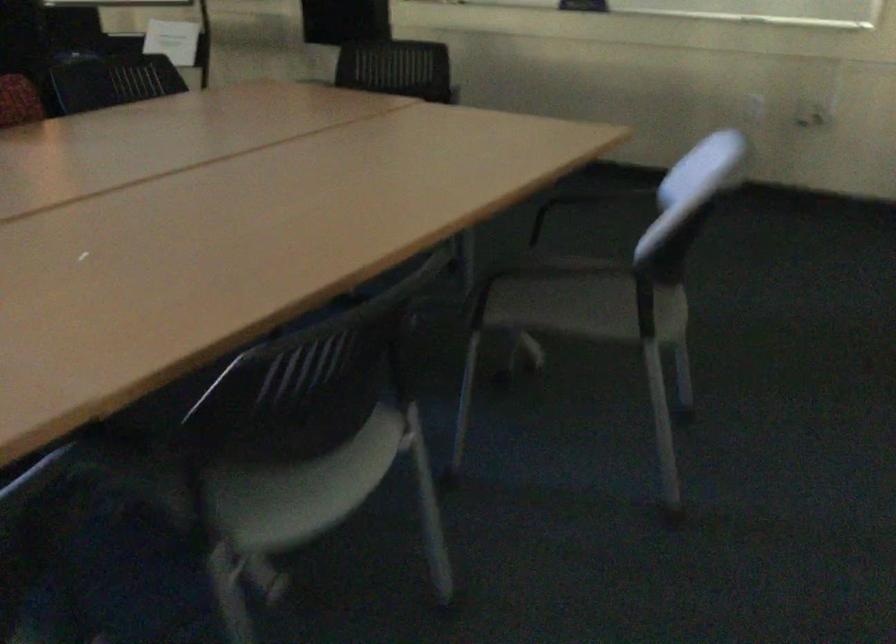
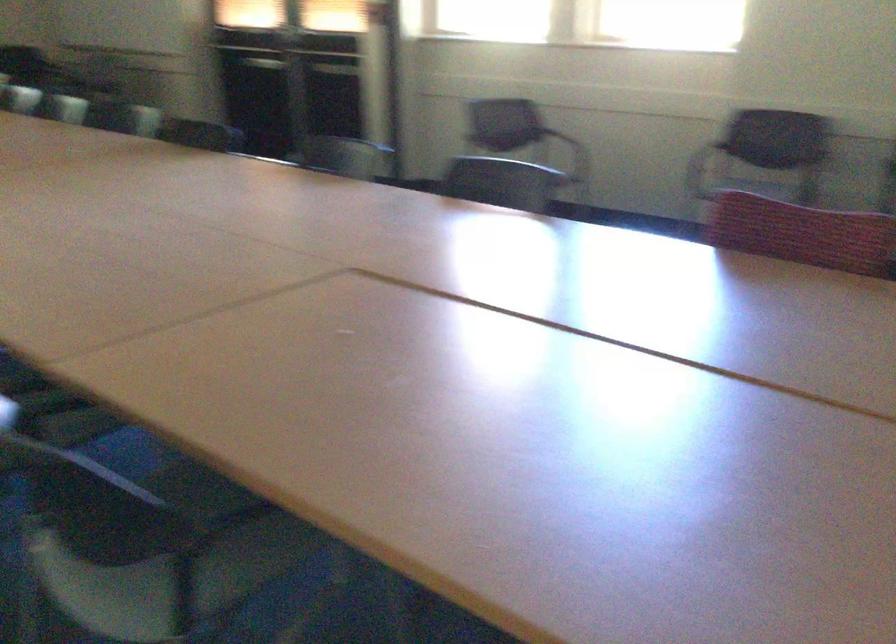
Where in the second image is the point corresponding to point (164, 469) from the first image?

(170, 467)